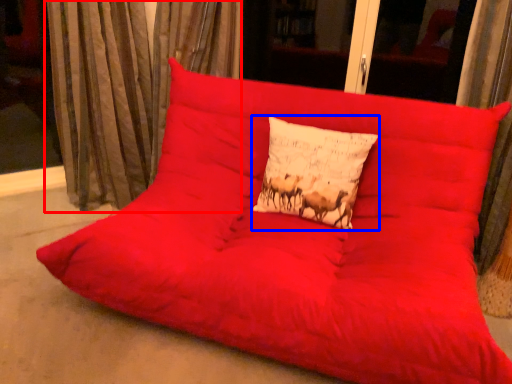
Question: Which object is closer to the camera taking this photo, curtain (highlighted by a red box) or pillow (highlighted by a blue box)?

Choices:
 (A) curtain
 (B) pillow

Answer: (B)